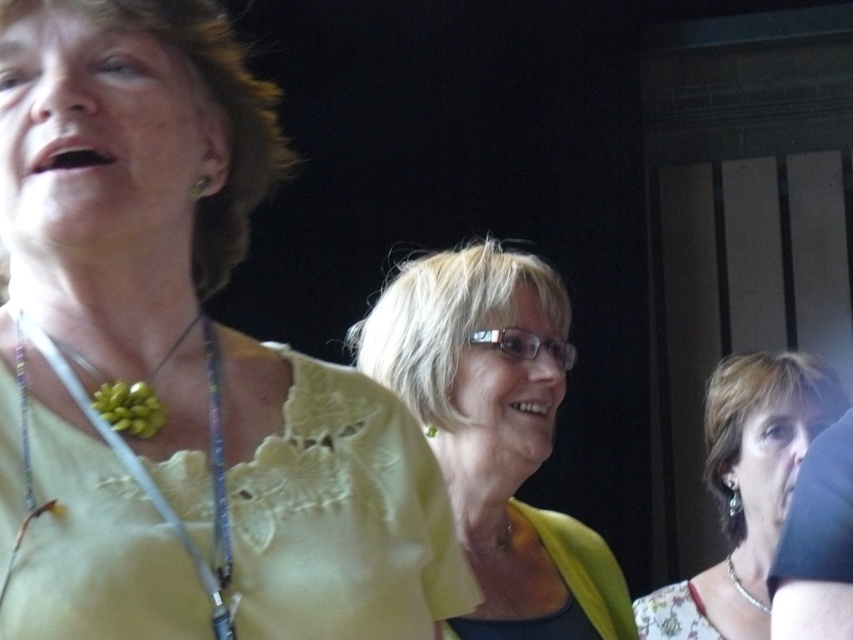
Is floral fabric dress at lower right thinner than green textured pendant at center?

In fact, floral fabric dress at lower right might be wider than green textured pendant at center.

The height and width of the screenshot is (640, 853). Describe the element at coordinates (762, 445) in the screenshot. I see `floral fabric dress at lower right` at that location.

Which is behind, point (807, 390) or point (106, 396)?

Point (807, 390)

Locate an element on the screen. This screenshot has height=640, width=853. floral fabric dress at lower right is located at coordinates (762, 445).

Which of these two, floral fabric dress at lower right or green beaded necklace at left, stands taller?

Standing taller between the two is floral fabric dress at lower right.

Between floral fabric dress at lower right and green beaded necklace at left, which one is positioned higher?

green beaded necklace at left is higher up.

Does point (746, 412) come in front of point (207, 573)?

No, it is behind (207, 573).

What are the coordinates of `floral fabric dress at lower right` in the screenshot? It's located at (762, 445).

Is light yellow fabric at center to the right of silver metallic necklace at lower right from the viewer's perspective?

Incorrect, light yellow fabric at center is not on the right side of silver metallic necklace at lower right.

Which is more to the right, light yellow fabric at center or silver metallic necklace at lower right?

silver metallic necklace at lower right is more to the right.

The height and width of the screenshot is (640, 853). I want to click on light yellow fabric at center, so [x=495, y=433].